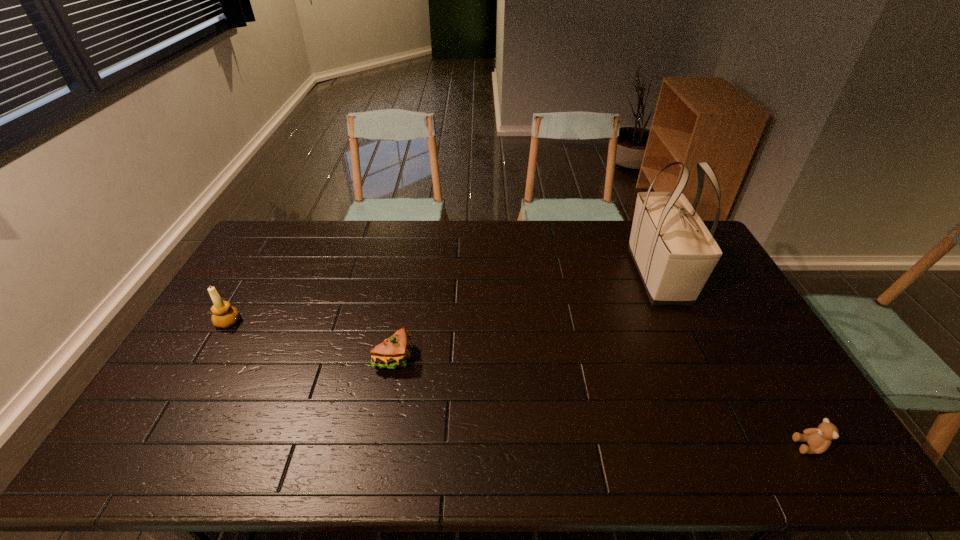
You are a GUI agent. You are given a task and a screenshot of the screen. Output one action in this format:
    pyautogui.click(x=<x>, y=<y>)
    Task: Click on the shopping bag
    
    Given the screenshot: What is the action you would take?
    pyautogui.click(x=674, y=252)

The width and height of the screenshot is (960, 540). In order to click on the tallest object in this screenshot , I will do `click(674, 252)`.

This screenshot has width=960, height=540. In order to click on the leftmost object in this screenshot , I will do `click(224, 315)`.

This screenshot has height=540, width=960. I want to click on candle_holder, so click(x=224, y=315).

Where is `the third object from right to left`? the third object from right to left is located at coordinates (392, 353).

Identify the location of the second shortest object. (392, 353).

This screenshot has height=540, width=960. I want to click on the nearest object, so click(819, 439).

Find the location of `teddy bear`. teddy bear is located at coordinates (819, 439).

The width and height of the screenshot is (960, 540). In order to click on free space located with handles facing forward on the tallest object in this screenshot , I will do `click(692, 348)`.

This screenshot has width=960, height=540. I want to click on free space located on the back of the second tallest object, so click(261, 267).